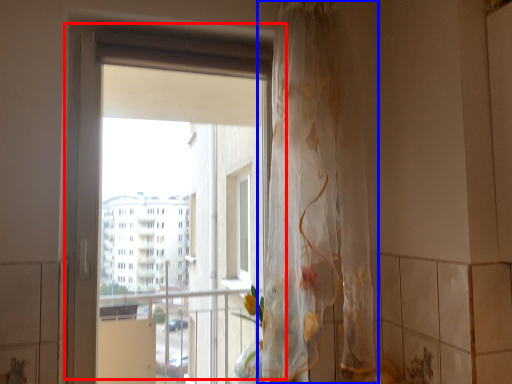
Question: Among these objects, which one is nearest to the camera, window (highlighted by a red box) or curtain (highlighted by a blue box)?

Choices:
 (A) window
 (B) curtain

Answer: (B)